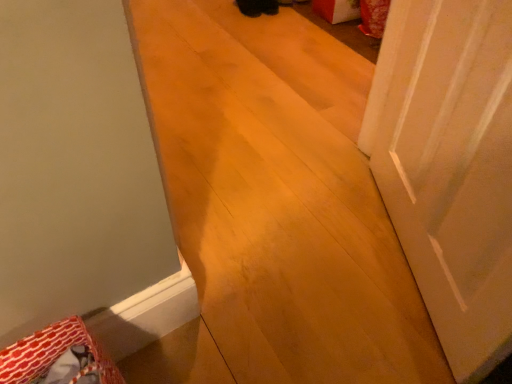
Describe the element at coordinates (449, 167) in the screenshot. I see `white matte door at right` at that location.

Identify the location of white matte door at right. (449, 167).

Measure the distance between point [411,262] and camera.

The depth of point [411,262] is 3.93 feet.

Measure the distance between white matte door at right and camera.

white matte door at right is 28.25 inches from camera.

The width and height of the screenshot is (512, 384). I want to click on white matte door at right, so tap(449, 167).